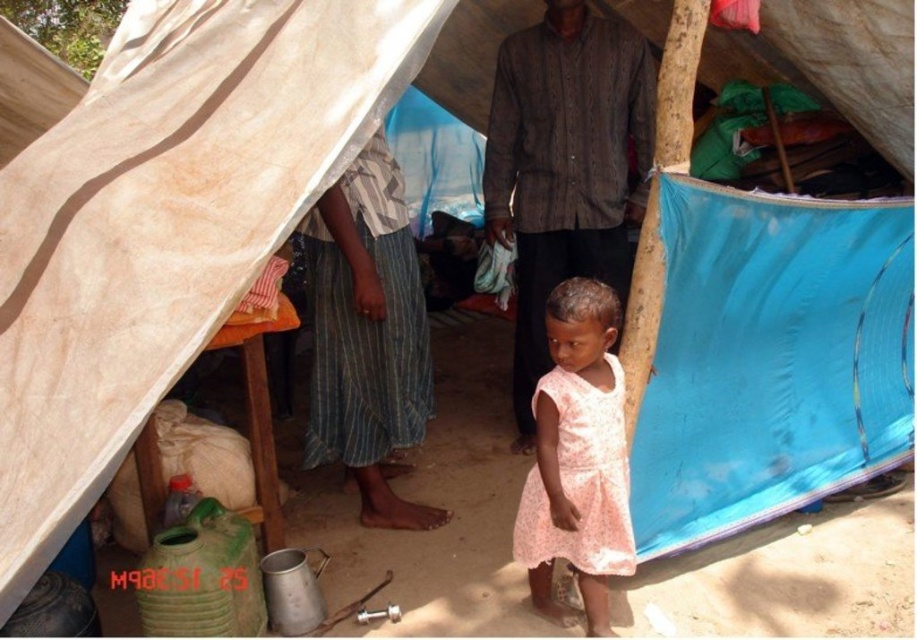
Question: Which point appears farthest from the camera in this image?

Choices:
 (A) (507, 225)
 (B) (529, 541)

Answer: (A)

Question: Does textured brown shirt at center appear over pink floral fabric dress at center?

Choices:
 (A) no
 (B) yes

Answer: (B)

Question: Among these objects, which one is nearest to the camera?

Choices:
 (A) pink floral fabric dress at center
 (B) textured brown shirt at center

Answer: (A)

Question: Does textured brown shirt at center come in front of pink floral fabric dress at center?

Choices:
 (A) yes
 (B) no

Answer: (B)

Question: Is textured brown shirt at center above pink floral fabric dress at center?

Choices:
 (A) no
 (B) yes

Answer: (B)